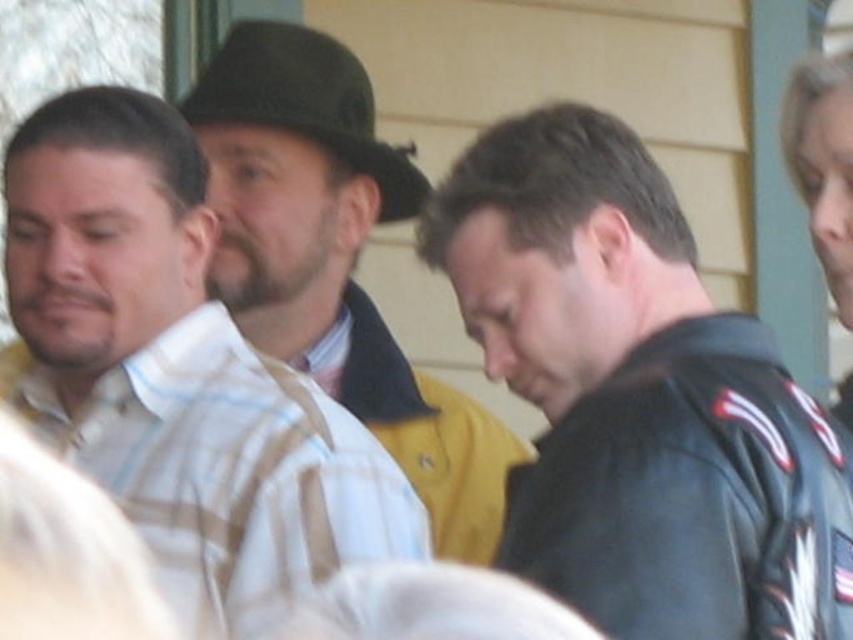
Is black leather jacket at center positioned before matte brown hat at center?

Yes, black leather jacket at center is in front of matte brown hat at center.

From the picture: Measure the distance between black leather jacket at center and camera.

black leather jacket at center and camera are 62.07 feet apart.

Find the location of a particular element. The width and height of the screenshot is (853, 640). black leather jacket at center is located at coordinates 637,396.

Can you confirm if striped cotton shirt at left is positioned to the left of matte brown hat at center?

Yes, striped cotton shirt at left is to the left of matte brown hat at center.

The width and height of the screenshot is (853, 640). Identify the location of striped cotton shirt at left. (178, 371).

I want to click on striped cotton shirt at left, so click(178, 371).

Can you confirm if matte brown hat at center is bigger than black felt fedora at center?

Indeed, matte brown hat at center has a larger size compared to black felt fedora at center.

Is point (312, 68) positioned in front of point (343, 93)?

That is True.

Is point (238, 54) closer to camera compared to point (253, 113)?

No, (238, 54) is behind (253, 113).

Identify the location of matte brown hat at center. (334, 260).